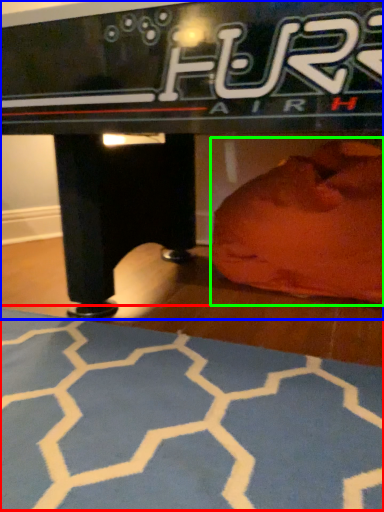
Question: Which is farther away from yoga mat (highlighted by a red box)? table (highlighted by a blue box) or bean bag chair (highlighted by a green box)?

Choices:
 (A) table
 (B) bean bag chair

Answer: (B)